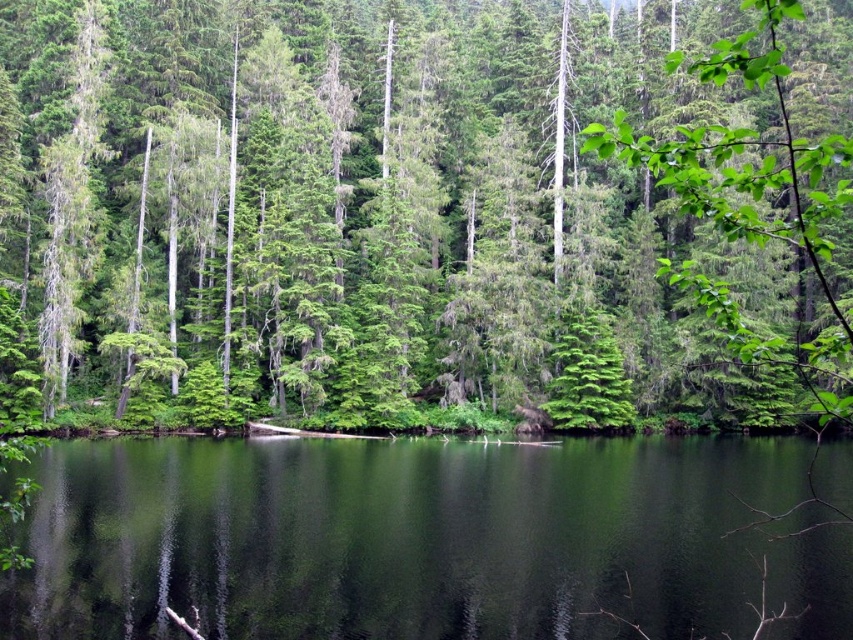
Between green matte tree at center and green reflective water at center, which one has more height?

green matte tree at center is taller.

Identify the location of green matte tree at center. This screenshot has width=853, height=640. (425, 209).

Describe the element at coordinates (425, 209) in the screenshot. Image resolution: width=853 pixels, height=640 pixels. I see `green matte tree at center` at that location.

Find the location of a particular element. The width and height of the screenshot is (853, 640). green matte tree at center is located at coordinates (425, 209).